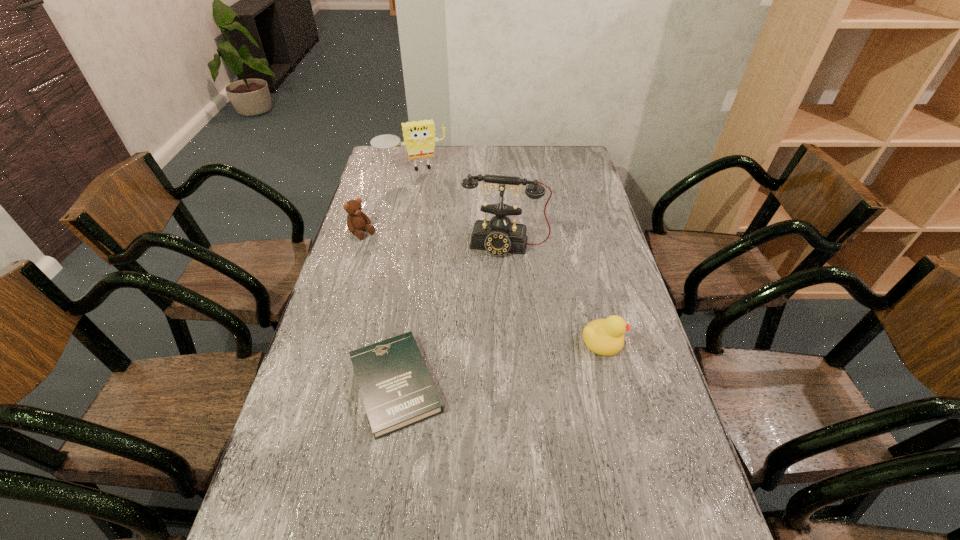
Locate an element on the screen. This screenshot has height=540, width=960. teddy bear present at the left edge is located at coordinates (356, 220).

At what (x,y) coordinates should I click in order to perform the action: click on sponge that is at the left edge. Please return your answer as a coordinate pair (x, y). Looking at the image, I should click on (419, 137).

This screenshot has height=540, width=960. I want to click on object present at the right edge, so click(x=604, y=337).

Locate an element on the screen. object that is positioned at the far left corner is located at coordinates (419, 137).

In the image, there is a desktop. In order to click on free space at the far edge in this screenshot , I will do `click(512, 164)`.

I want to click on vacant area at the near edge of the desktop, so click(412, 517).

In the image, there is a desktop. Where is `free space at the right edge`? free space at the right edge is located at coordinates (593, 186).

In the image, there is a desktop. At what (x,y) coordinates should I click in order to perform the action: click on vacant space at the far right corner. Please return your answer as a coordinate pair (x, y). Image resolution: width=960 pixels, height=540 pixels. Looking at the image, I should click on pyautogui.click(x=567, y=148).

Where is `empty space that is in between the tallest object and the sponge`? The height and width of the screenshot is (540, 960). empty space that is in between the tallest object and the sponge is located at coordinates (459, 207).

At what (x,y) coordinates should I click in order to perform the action: click on free point between the sponge and the shortest object. Please return your answer as a coordinate pair (x, y). The width and height of the screenshot is (960, 540). Looking at the image, I should click on (403, 278).